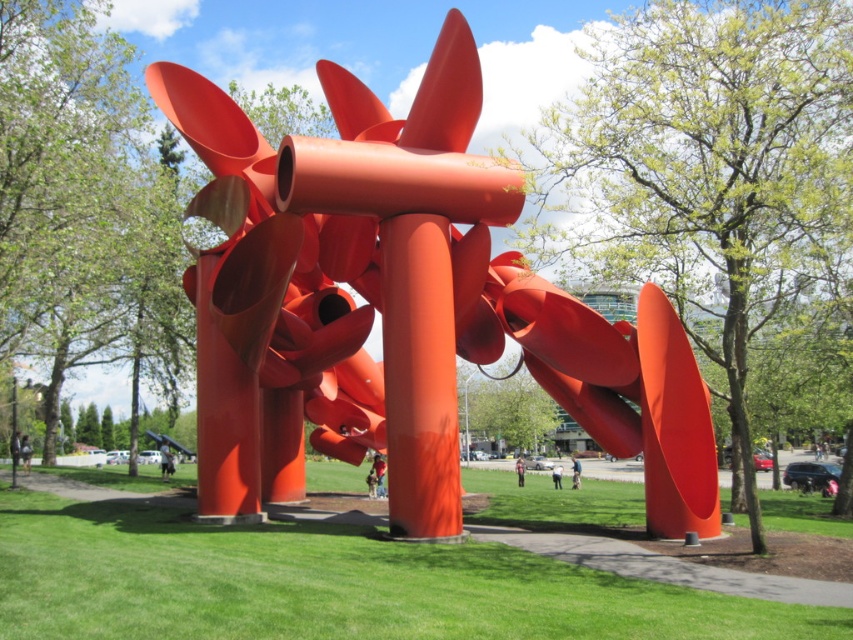
Who is more forward, (18, 449) or (556, 465)?

Point (18, 449) is in front.

Is dark gray suit at center closer to the viewer compared to skinny jeans at center?

Yes, dark gray suit at center is in front of skinny jeans at center.

What are the coordinates of `dark gray suit at center` in the screenshot? It's located at (15, 449).

The image size is (853, 640). I want to click on dark gray suit at center, so [15, 449].

Between point (380, 454) and point (572, 456), which one is positioned in front?

Positioned in front is point (380, 454).

Who is lower down, matte red pants at center or blue denim jeans at center?

Positioned lower is blue denim jeans at center.

Is point (376, 488) in front of point (573, 454)?

Yes, point (376, 488) is closer to viewer.

I want to click on matte red pants at center, so [379, 474].

Can you confirm if matte red pants at center is shorter than denim jacket at lower center?

Correct, matte red pants at center is not as tall as denim jacket at lower center.

Is point (384, 458) positioned in front of point (521, 481)?

Yes, point (384, 458) is in front of point (521, 481).

Find the location of a particular element. Image resolution: width=853 pixels, height=640 pixels. matte red pants at center is located at coordinates (379, 474).